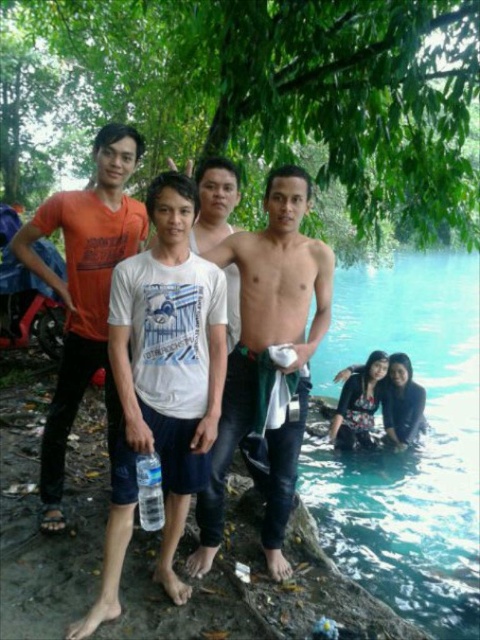
You are standing at the center of the scene and want to move towards both points mentioned. Which point, point [88,253] or point [146,452], will you reach first?

You will reach point [88,253] first because it is closer to you than point [146,452], which is further away.